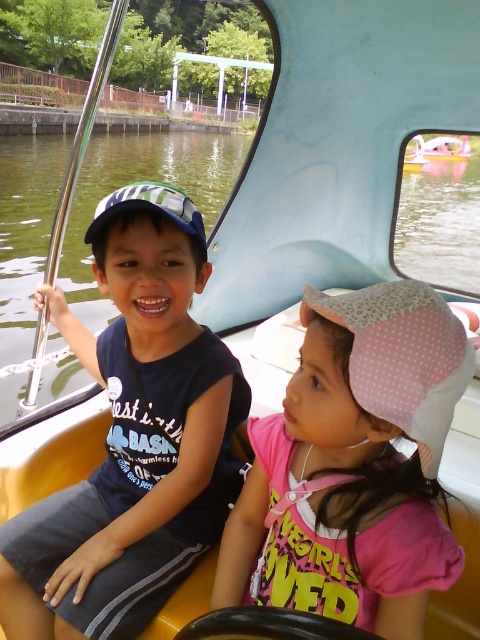
Which is more to the left, green water at center or pink fabric boat at center?

From the viewer's perspective, green water at center appears more on the left side.

Which of these two, green water at center or pink fabric boat at center, stands taller?

Standing taller between the two is green water at center.

Where is `green water at center`? The width and height of the screenshot is (480, 640). green water at center is located at coordinates (141, 179).

Consider the image. Does matte black shirt at center appear on the left side of pink fabric boat at center?

Yes, matte black shirt at center is to the left of pink fabric boat at center.

Is matte black shirt at center taller than pink fabric boat at center?

No, matte black shirt at center is not taller than pink fabric boat at center.

Which is behind, point (130, 438) or point (464, 154)?

Point (464, 154)

Image resolution: width=480 pixels, height=640 pixels. I want to click on matte black shirt at center, so click(133, 436).

Which is more to the left, pink dotted fabric hat at center or pink fabric boat at center?

pink dotted fabric hat at center is more to the left.

Does pink dotted fabric hat at center come in front of pink fabric boat at center?

Yes, it is.

Which is behind, point (370, 477) or point (419, 148)?

Positioned behind is point (419, 148).

This screenshot has width=480, height=640. In order to click on pink dotted fabric hat at center in this screenshot , I will do `click(355, 465)`.